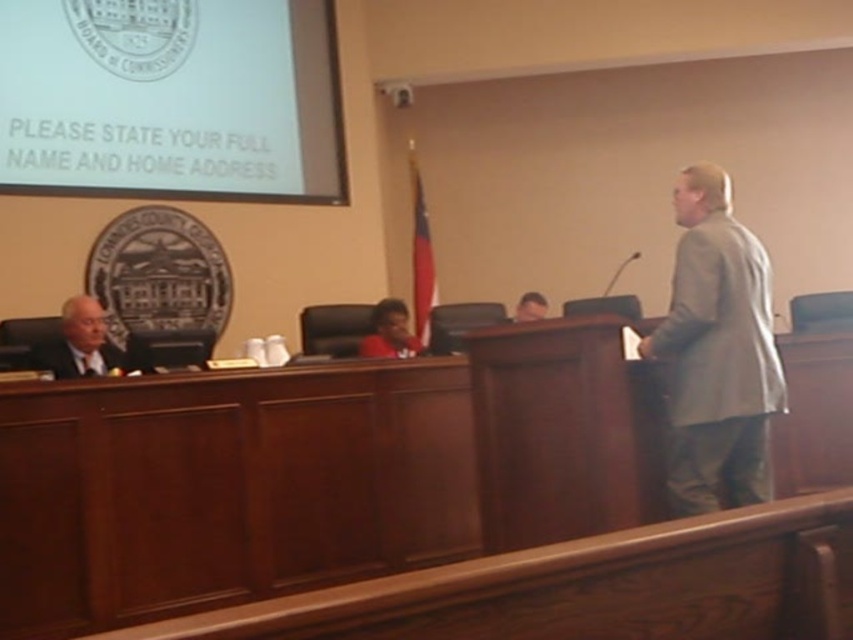
Question: Which point is farther to the camera?

Choices:
 (A) (735, 285)
 (B) (62, 346)

Answer: (B)

Question: Observing the image, what is the correct spatial positioning of gray fabric suit at right in reference to smooth gray suit at center?

Choices:
 (A) above
 (B) below

Answer: (B)

Question: Which point is closer to the camera?

Choices:
 (A) gray fabric suit at right
 (B) gray suit at left

Answer: (A)

Question: Does dark gray fabric business suit at left appear on the left side of smooth gray suit at center?

Choices:
 (A) no
 (B) yes

Answer: (B)

Question: Where is gray suit at left located in relation to smooth gray suit at center in the image?

Choices:
 (A) left
 (B) right

Answer: (A)

Question: Which is nearer to the gray suit at left?

Choices:
 (A) smooth gray suit at center
 (B) dark gray fabric business suit at left
 (C) gray fabric suit at right

Answer: (B)